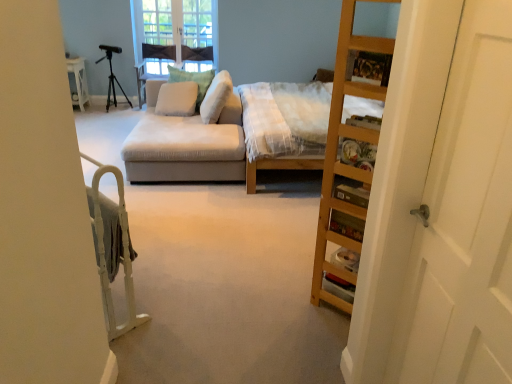
What do you see at coordinates (176, 26) in the screenshot?
I see `clear glass window at upper center` at bounding box center [176, 26].

In order to face beige fabric pillow at center, acting as the first pillow starting from the left, should I rotate leftwards or rightwards?

You should look left and rotate roughly 10.383 degrees.

What do you see at coordinates (284, 120) in the screenshot?
I see `light brown wooden bed at center` at bounding box center [284, 120].

Measure the distance between black matte tripod at upper left and camera.

The distance of black matte tripod at upper left from camera is 6.83 meters.

The height and width of the screenshot is (384, 512). What are the coordinates of `clear glass window at upper center` in the screenshot? It's located at (176, 26).

Is suede-like beige couch at center at the back of beige fabric pillow at center, the 3th pillow positioned from the right?

That's right, beige fabric pillow at center, the 3th pillow positioned from the right, is facing away from suede-like beige couch at center.

How different are the orientations of beige fabric pillow at center, acting as the first pillow starting from the left, and suede-like beige couch at center in degrees?

There is a 78.1-degree angle between the facing directions of beige fabric pillow at center, acting as the first pillow starting from the left, and suede-like beige couch at center.

Looking at this image, which object is closer to the camera taking this photo, beige fabric pillow at center, acting as the first pillow starting from the left, or suede-like beige couch at center?

suede-like beige couch at center.

Consider the image. Which object is positioned more to the right, beige fabric pillow at center, acting as the first pillow starting from the left, or suede-like beige couch at center?

From the viewer's perspective, suede-like beige couch at center appears more on the right side.

How many degrees apart are the facing directions of green textured pillow at center, which is the second pillow from left to right, and wooden bookshelf at right?

The angular difference between green textured pillow at center, which is the second pillow from left to right, and wooden bookshelf at right is 123 degrees.

Who is more distant, green textured pillow at center, the second pillow in the right-to-left sequence, or wooden bookshelf at right?

green textured pillow at center, the second pillow in the right-to-left sequence, is more distant.

From the image's perspective, is green textured pillow at center, which is the second pillow from left to right, on wooden bookshelf at right?

Result: Indeed, from the image's perspective, green textured pillow at center, which is the second pillow from left to right, is shown above wooden bookshelf at right.

From a real-world perspective, between green textured pillow at center, which is the second pillow from left to right, and wooden bookshelf at right, who is vertically higher?

wooden bookshelf at right is physically above.

Who is taller, beige fabric pillow at center, the 3th pillow positioned from the right, or white glossy table at upper left?

With more height is white glossy table at upper left.

Which object is closer to the camera taking this photo, beige fabric pillow at center, acting as the first pillow starting from the left, or white glossy table at upper left?

Positioned in front is beige fabric pillow at center, acting as the first pillow starting from the left.

At what (x,y) coordinates should I click in order to perform the action: click on table below the beige fabric pillow at center, acting as the first pillow starting from the left (from a real-world perspective). Please return your answer as a coordinate pair (x, y). The image size is (512, 384). Looking at the image, I should click on (78, 82).

Which is more to the right, beige fabric pillow at center, acting as the first pillow starting from the left, or white glossy table at upper left?

beige fabric pillow at center, acting as the first pillow starting from the left, is more to the right.

From the image's perspective, which is above, wooden bookshelf at right or white fabric pillow at center, which is the 1th pillow in right-to-left order?

From the image's view, white fabric pillow at center, which is the 1th pillow in right-to-left order, is above.

How many degrees apart are the facing directions of wooden bookshelf at right and white fabric pillow at center, placed as the third pillow when sorted from left to right?

The facing directions of wooden bookshelf at right and white fabric pillow at center, placed as the third pillow when sorted from left to right, are 45.3 degrees apart.

Starting from the wooden bookshelf at right, which pillow is the 1st one to the left? Please provide its 2D coordinates.

[(216, 97)]

From a real-world perspective, does wooden bookshelf at right stand above white fabric pillow at center, which is the 1th pillow in right-to-left order?

Yes, from a real-world perspective, wooden bookshelf at right is over white fabric pillow at center, which is the 1th pillow in right-to-left order

From a real-world perspective, does white wood bed frame at left stand above green textured pillow at center, the second pillow in the right-to-left sequence?

Actually, white wood bed frame at left is physically below green textured pillow at center, the second pillow in the right-to-left sequence, in the real world.

Is white wood bed frame at left aimed at green textured pillow at center, which is the second pillow from left to right?

No, white wood bed frame at left is not facing towards green textured pillow at center, which is the second pillow from left to right.

Can you confirm if white wood bed frame at left is bigger than green textured pillow at center, which is the second pillow from left to right?

No, white wood bed frame at left is not bigger than green textured pillow at center, which is the second pillow from left to right.

Does black matte tripod at upper left turn towards clear glass window at upper center?

No.

Is black matte tripod at upper left positioned in front of clear glass window at upper center?

That is True.

Locate an element on the screen. The image size is (512, 384). tripod below the clear glass window at upper center (from the image's perspective) is located at coordinates (112, 75).

Could you tell me if white wooden door at right is facing light brown wooden bed at center?

No, white wooden door at right is not oriented towards light brown wooden bed at center.

At what (x,y) coordinates should I click in order to perform the action: click on bed that is on the left side of white wooden door at right. Please return your answer as a coordinate pair (x, y). Looking at the image, I should click on (284, 120).

Based on the photo, would you say white wooden door at right is outside light brown wooden bed at center?

Indeed, white wooden door at right is completely outside light brown wooden bed at center.

Identify the location of studio couch in front of the beige fabric pillow at center, acting as the first pillow starting from the left. (191, 143).

I want to click on cabinet below the green textured pillow at center, which is the second pillow from left to right (from the image's perspective), so click(x=345, y=163).

Which object lies nearer to the anchor point white glossy table at upper left, white wood bed frame at left or green textured pillow at center, which is the second pillow from left to right?

The object closer to white glossy table at upper left is green textured pillow at center, which is the second pillow from left to right.

In the scene shown: Based on their spatial positions, is clear glass window at upper center or suede-like beige couch at center closer to beige fabric pillow at center, the 3th pillow positioned from the right?

The object closer to beige fabric pillow at center, the 3th pillow positioned from the right, is suede-like beige couch at center.

Based on their spatial positions, is white wooden door at right or white fabric pillow at center, placed as the third pillow when sorted from left to right, closer to suede-like beige couch at center?

white fabric pillow at center, placed as the third pillow when sorted from left to right, lies closer to suede-like beige couch at center than the other object.

When comparing their distances from white fabric pillow at center, which is the 1th pillow in right-to-left order, does suede-like beige couch at center or black matte tripod at upper left seem closer?

The object closer to white fabric pillow at center, which is the 1th pillow in right-to-left order, is suede-like beige couch at center.

From the image, which object appears to be farther from green textured pillow at center, which is the second pillow from left to right, white wooden door at right or suede-like beige couch at center?

white wooden door at right is further to green textured pillow at center, which is the second pillow from left to right.

Based on their spatial positions, is black matte tripod at upper left or white wood bed frame at left further from wooden bookshelf at right?

black matte tripod at upper left.

Considering their positions, is wooden bookshelf at right positioned closer to white wooden door at right than green textured pillow at center, which is the second pillow from left to right?

Based on the image, wooden bookshelf at right appears to be nearer to white wooden door at right.

Based on their spatial positions, is suede-like beige couch at center or black matte tripod at upper left further from white glossy table at upper left?

Based on the image, suede-like beige couch at center appears to be further to white glossy table at upper left.

The height and width of the screenshot is (384, 512). Identify the location of studio couch located between white wooden door at right and clear glass window at upper center in the depth direction. (191, 143).

The height and width of the screenshot is (384, 512). I want to click on studio couch between wooden bookshelf at right and beige fabric pillow at center, acting as the first pillow starting from the left, from front to back, so click(191, 143).

The height and width of the screenshot is (384, 512). Identify the location of studio couch positioned between wooden bookshelf at right and white fabric pillow at center, placed as the third pillow when sorted from left to right, from near to far. (191, 143).

Find the location of a particular element. window located between white glossy table at upper left and beige fabric pillow at center, the 3th pillow positioned from the right, in the left-right direction is located at coordinates (176, 26).